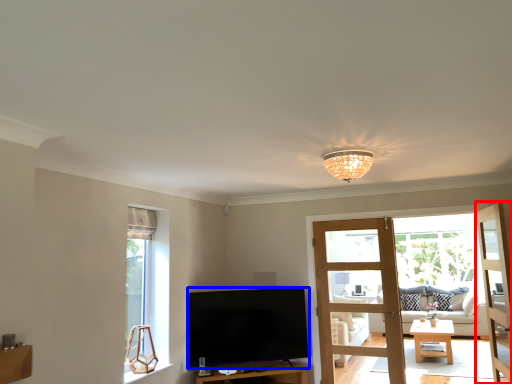
Question: Which of the following is the farthest to the observer, door (highlighted by a red box) or television (highlighted by a blue box)?

Choices:
 (A) door
 (B) television

Answer: (B)